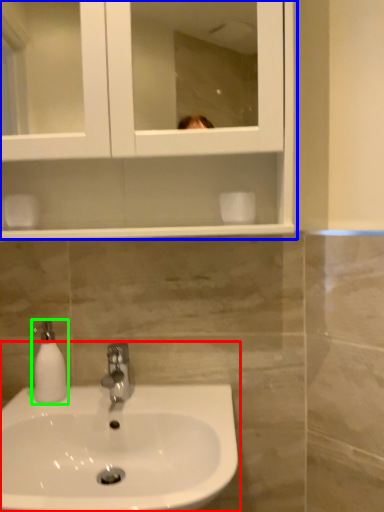
Question: Which is farther away from sink (highlighted by a red box)? medicine cabinet (highlighted by a blue box) or soap dispenser (highlighted by a green box)?

Choices:
 (A) medicine cabinet
 (B) soap dispenser

Answer: (A)